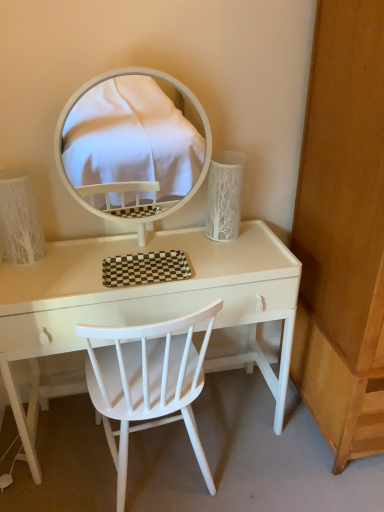
The height and width of the screenshot is (512, 384). Identify the location of empty space that is in between white glossy mirror at upper center and white textured lampshade at left, which appears as the 2th table lamp when viewed from the right. (84, 251).